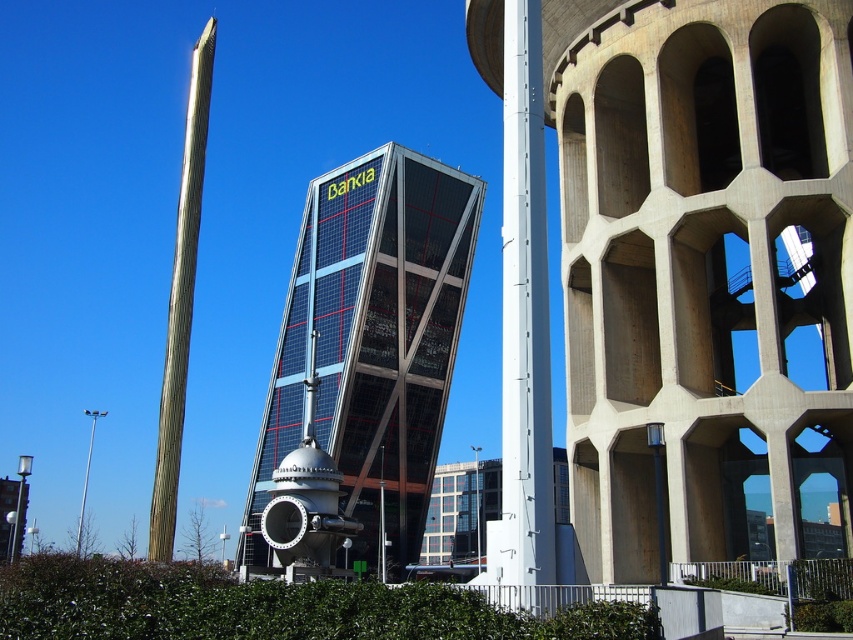
You are an architect analyzing the urban layout. Given the glassy steel skyscraper at center and the green textured pole at left, which one appears to be closer to the viewer based on their sizes?

The green textured pole at left appears closer to the viewer because it is larger in size compared to the glassy steel skyscraper at center, which is smaller.